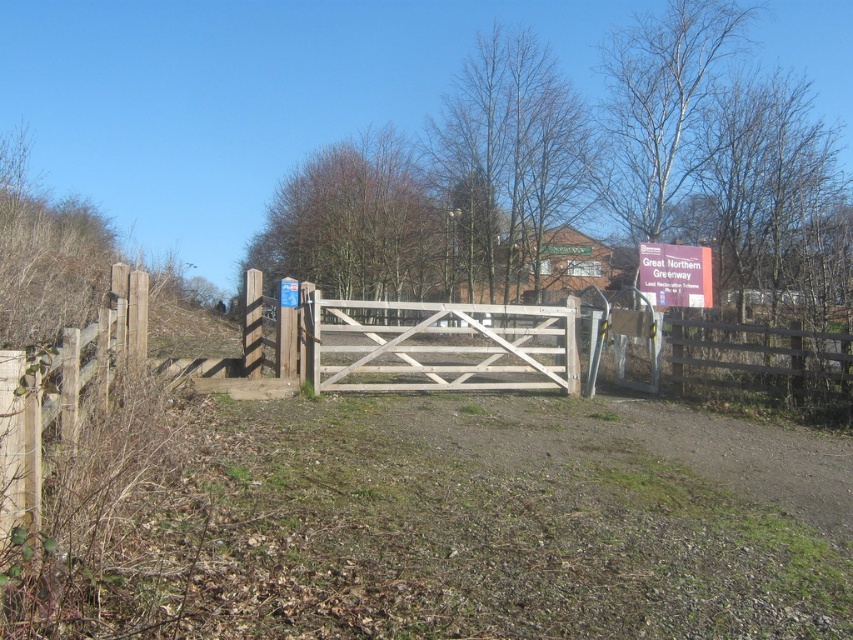
Question: Is white wooden gate at center in front of purple matte sign at upper right?

Choices:
 (A) yes
 (B) no

Answer: (A)

Question: Which object is closer to the camera taking this photo?

Choices:
 (A) white wooden gate at center
 (B) purple matte sign at upper right

Answer: (A)

Question: Is white wooden gate at center thinner than purple matte sign at upper right?

Choices:
 (A) yes
 (B) no

Answer: (B)

Question: Which object appears farthest from the camera in this image?

Choices:
 (A) white wooden gate at center
 (B) purple matte sign at upper right

Answer: (B)

Question: Can you confirm if white wooden gate at center is positioned to the right of purple matte sign at upper right?

Choices:
 (A) yes
 (B) no

Answer: (B)

Question: Which of the following is the farthest from the observer?

Choices:
 (A) purple matte sign at upper right
 (B) white wooden gate at center

Answer: (A)